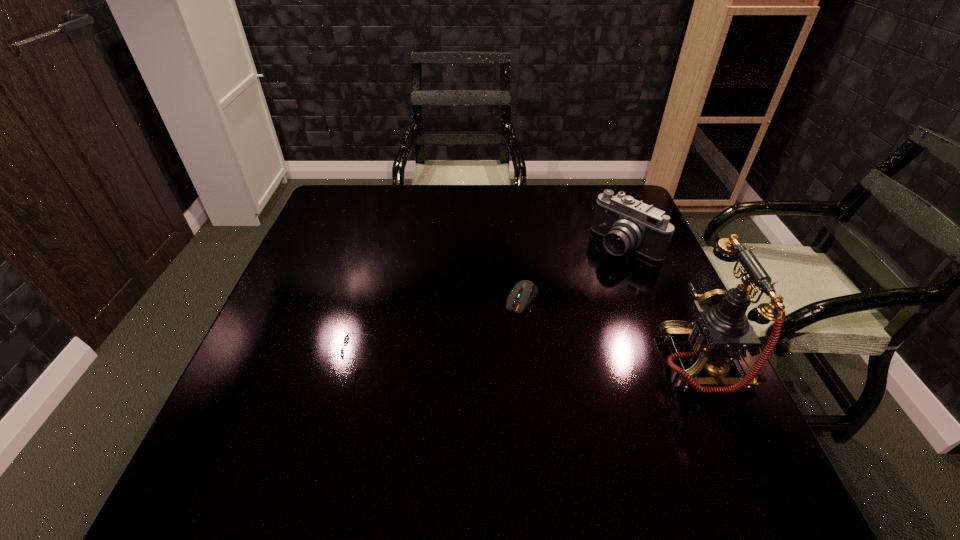
Find the location of a particular element. object present at the far right corner is located at coordinates (627, 224).

The height and width of the screenshot is (540, 960). Find the location of `object that is positioned at the near right corner`. object that is positioned at the near right corner is located at coordinates (720, 331).

In the image, there is a desktop. Where is `vacant space at the far edge`? vacant space at the far edge is located at coordinates (459, 219).

Image resolution: width=960 pixels, height=540 pixels. I want to click on free space at the near edge of the desktop, so [310, 418].

Locate an element on the screen. free space at the left edge of the desktop is located at coordinates (302, 305).

Locate an element on the screen. The width and height of the screenshot is (960, 540). free location at the near right corner of the desktop is located at coordinates (652, 409).

Identify the location of vacant space that is in between the computer equipment and the second tallest object. The height and width of the screenshot is (540, 960). (574, 272).

In order to click on free space between the leftmost object and the farthest object in this screenshot , I will do `click(495, 304)`.

Identify the location of vacant area that lies between the third shortest object and the tallest object. Image resolution: width=960 pixels, height=540 pixels. (666, 303).

Identify the location of vacant space that's between the second tallest object and the third tallest object. (495, 304).